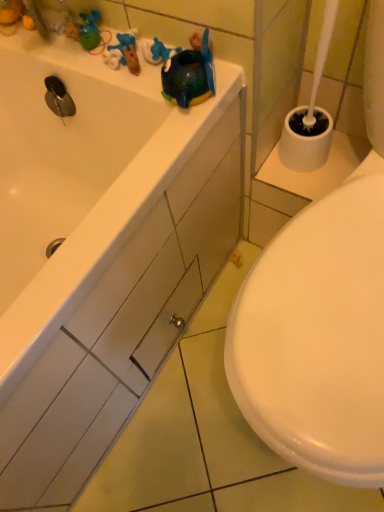
Question: From a real-world perspective, is white glossy bathtub at upper left physically below white glossy drawer at center?

Choices:
 (A) yes
 (B) no

Answer: (B)

Question: From a real-world perspective, is white glossy bathtub at upper left over white glossy drawer at center?

Choices:
 (A) no
 (B) yes

Answer: (B)

Question: Is white glossy bathtub at upper left positioned beyond the bounds of white glossy drawer at center?

Choices:
 (A) no
 (B) yes

Answer: (B)

Question: Is white glossy bathtub at upper left to the left of white glossy drawer at center from the viewer's perspective?

Choices:
 (A) no
 (B) yes

Answer: (B)

Question: Does white glossy bathtub at upper left have a greater height compared to white glossy drawer at center?

Choices:
 (A) yes
 (B) no

Answer: (A)

Question: Is white glossy bathtub at upper left facing towards white glossy drawer at center?

Choices:
 (A) no
 (B) yes

Answer: (B)

Question: Is white glossy drawer at center at the right side of white glossy bathtub at upper left?

Choices:
 (A) yes
 (B) no

Answer: (A)

Question: From a real-world perspective, is white glossy drawer at center positioned over white glossy bathtub at upper left based on gravity?

Choices:
 (A) yes
 (B) no

Answer: (B)

Question: Is white glossy drawer at center positioned far away from white glossy bathtub at upper left?

Choices:
 (A) no
 (B) yes

Answer: (A)

Question: Considering the relative sizes of white glossy drawer at center and white glossy bathtub at upper left in the image provided, is white glossy drawer at center shorter than white glossy bathtub at upper left?

Choices:
 (A) yes
 (B) no

Answer: (A)

Question: Is white glossy drawer at center bigger than white glossy bathtub at upper left?

Choices:
 (A) no
 (B) yes

Answer: (A)

Question: Is the depth of white glossy drawer at center greater than that of white glossy bathtub at upper left?

Choices:
 (A) no
 (B) yes

Answer: (B)

Question: From the image's perspective, is white glossy bathtub at upper left positioned above or below white glossy drawer at center?

Choices:
 (A) below
 (B) above

Answer: (B)